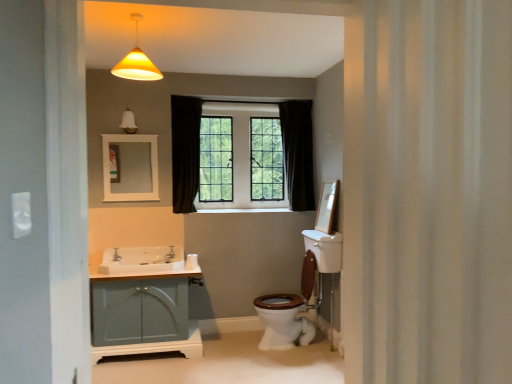
This screenshot has width=512, height=384. What do you see at coordinates (298, 152) in the screenshot?
I see `black glass window at center` at bounding box center [298, 152].

Measure the distance between point (133, 133) and camera.

Point (133, 133) and camera are 12.56 feet apart from each other.

What is the approximate height of matte glass bell at upper center?

It is 11.03 inches.

You are a GUI agent. You are given a task and a screenshot of the screen. Output one action in this format:
    pyautogui.click(x=<x>, y=<y>)
    Task: Click on the white textured shower curtain at right
    This screenshot has height=384, width=512.
    Given the screenshot: What is the action you would take?
    pyautogui.click(x=437, y=191)

This screenshot has width=512, height=384. I want to click on dark fabric curtain at center, the first curtain viewed from the right, so coord(298,152).

Where is `white matte mirror at upper center`? Image resolution: width=512 pixels, height=384 pixels. white matte mirror at upper center is located at coordinates (130, 167).

You are a GUI agent. You are given a task and a screenshot of the screen. Output one action in this format:
    pyautogui.click(x=<x>, y=<y>)
    Task: Click on the black glass window at center
    
    Given the screenshot: What is the action you would take?
    pyautogui.click(x=298, y=152)

From the image's perspective, which is above, dark fabric curtain at center, positioned as the first curtain in left-to-right order, or brushed metal faucet at sink left, which ranks as the 2th faucet in front-to-back order?

dark fabric curtain at center, positioned as the first curtain in left-to-right order, is shown above in the image.

From a real-world perspective, does dark fabric curtain at center, positioned as the first curtain in left-to-right order, stand above brushed metal faucet at sink left, which appears as the first faucet when viewed from the right?

Correct, in the physical world, dark fabric curtain at center, positioned as the first curtain in left-to-right order, is higher than brushed metal faucet at sink left, which appears as the first faucet when viewed from the right.

Consider the image. Which object is more forward, dark fabric curtain at center, positioned as the 2th curtain in right-to-left order, or brushed metal faucet at sink left, arranged as the 1th faucet when viewed from the back?

brushed metal faucet at sink left, arranged as the 1th faucet when viewed from the back, is more forward.

Is dark fabric curtain at center, positioned as the first curtain in left-to-right order, turned away from brushed metal faucet at sink left, arranged as the 1th faucet when viewed from the back?

No, dark fabric curtain at center, positioned as the first curtain in left-to-right order,'s orientation is not away from brushed metal faucet at sink left, arranged as the 1th faucet when viewed from the back.

Is point (199, 155) less distant than point (478, 94)?

No, (199, 155) is behind (478, 94).

Is dark fabric curtain at center, positioned as the first curtain in left-to-right order, touching white textured shower curtain at right?

They are not placed beside each other.

Can you confirm if dark fabric curtain at center, positioned as the 2th curtain in right-to-left order, is bigger than white textured shower curtain at right?

Correct, dark fabric curtain at center, positioned as the 2th curtain in right-to-left order, is larger in size than white textured shower curtain at right.

Can you confirm if dark fabric curtain at center, positioned as the first curtain in left-to-right order, is positioned to the right of white textured shower curtain at right?

No.

Which is in front, point (180, 139) or point (307, 164)?

The point (180, 139) is more forward.

Can you confirm if dark fabric curtain at center, positioned as the 2th curtain in right-to-left order, is thinner than dark fabric curtain at center, which is counted as the 2th curtain, starting from the left?

Correct, the width of dark fabric curtain at center, positioned as the 2th curtain in right-to-left order, is less than that of dark fabric curtain at center, which is counted as the 2th curtain, starting from the left.

Which is in front, dark fabric curtain at center, positioned as the first curtain in left-to-right order, or dark fabric curtain at center, which is counted as the 2th curtain, starting from the left?

Positioned in front is dark fabric curtain at center, positioned as the first curtain in left-to-right order.

Can you tell me how much dark fabric curtain at center, positioned as the first curtain in left-to-right order, and dark fabric curtain at center, which is counted as the 2th curtain, starting from the left, differ in facing direction?

The angular difference between dark fabric curtain at center, positioned as the first curtain in left-to-right order, and dark fabric curtain at center, which is counted as the 2th curtain, starting from the left, is 0.00267 degrees.

What's the angular difference between white matte toilet paper at lower center and dark fabric curtain at center, positioned as the 2th curtain in right-to-left order,'s facing directions?

They differ by 3.28 degrees in their facing directions.

Is white matte toilet paper at lower center oriented towards dark fabric curtain at center, positioned as the first curtain in left-to-right order?

No, white matte toilet paper at lower center is not turned towards dark fabric curtain at center, positioned as the first curtain in left-to-right order.

Looking at this image, which of these two, white matte toilet paper at lower center or dark fabric curtain at center, positioned as the 2th curtain in right-to-left order, is thinner?

Thinner between the two is white matte toilet paper at lower center.

Is white matte toilet paper at lower center surrounding dark fabric curtain at center, positioned as the 2th curtain in right-to-left order?

That's incorrect, dark fabric curtain at center, positioned as the 2th curtain in right-to-left order, is not inside white matte toilet paper at lower center.

How much distance is there between white textured shower curtain at right and brushed metal faucet at sink left, which ranks as the 2th faucet in front-to-back order?

A distance of 3.22 meters exists between white textured shower curtain at right and brushed metal faucet at sink left, which ranks as the 2th faucet in front-to-back order.

From a real-world perspective, does white textured shower curtain at right sit lower than brushed metal faucet at sink left, arranged as the 1th faucet when viewed from the back?

No, from a real-world perspective, white textured shower curtain at right is not below brushed metal faucet at sink left, arranged as the 1th faucet when viewed from the back.

From the picture: Considering the relative positions of white textured shower curtain at right and brushed metal faucet at sink left, arranged as the 1th faucet when viewed from the back, in the image provided, is white textured shower curtain at right to the left of brushed metal faucet at sink left, arranged as the 1th faucet when viewed from the back, from the viewer's perspective?

No.

Is white textured shower curtain at right oriented away from brushed metal faucet at sink left, which ranks as the 2th faucet in front-to-back order?

No, white textured shower curtain at right is not facing away from brushed metal faucet at sink left, which ranks as the 2th faucet in front-to-back order.

Is dark fabric curtain at center, which is counted as the 2th curtain, starting from the left, positioned in front of brushed metal faucet at sink left, arranged as the 1th faucet when viewed from the back?

No, the depth of dark fabric curtain at center, which is counted as the 2th curtain, starting from the left, is greater than that of brushed metal faucet at sink left, arranged as the 1th faucet when viewed from the back.

Is dark fabric curtain at center, which is counted as the 2th curtain, starting from the left, positioned with its back to brushed metal faucet at sink left, which ranks as the 2th faucet in front-to-back order?

No, dark fabric curtain at center, which is counted as the 2th curtain, starting from the left, is not facing the opposite direction of brushed metal faucet at sink left, which ranks as the 2th faucet in front-to-back order.

Does dark fabric curtain at center, which is counted as the 2th curtain, starting from the left, have a lesser height compared to brushed metal faucet at sink left, arranged as the 1th faucet when viewed from the back?

No.

At what (x,y) coordinates should I click in order to perform the action: click on the 1st faucet counting from the left side of the dark fabric curtain at center, which is counted as the 2th curtain, starting from the left. Please return your answer as a coordinate pair (x, y). This screenshot has width=512, height=384. Looking at the image, I should click on (170, 254).

Between dark fabric curtain at center, which is counted as the 2th curtain, starting from the left, and white glossy sink at lower left, which one is positioned behind?

dark fabric curtain at center, which is counted as the 2th curtain, starting from the left, is more distant.

Considering the relative positions of dark fabric curtain at center, the first curtain viewed from the right, and white glossy sink at lower left in the image provided, is dark fabric curtain at center, the first curtain viewed from the right, to the right of white glossy sink at lower left from the viewer's perspective?

Yes, dark fabric curtain at center, the first curtain viewed from the right, is to the right of white glossy sink at lower left.

In terms of width, does dark fabric curtain at center, which is counted as the 2th curtain, starting from the left, look wider or thinner when compared to white glossy sink at lower left?

In the image, dark fabric curtain at center, which is counted as the 2th curtain, starting from the left, appears to be more narrow than white glossy sink at lower left.

This screenshot has height=384, width=512. I want to click on faucet that is the 1st one when counting forward from the dark fabric curtain at center, positioned as the first curtain in left-to-right order, so click(x=170, y=254).

From a real-world perspective, count 2nd curtains upward from the white textured shower curtain at right and point to it. Please provide its 2D coordinates.

[(185, 151)]

Based on their spatial positions, is white glossy sink at lower left or white matte mirror at upper center further from white matte toilet paper at lower center?

Based on the image, white matte mirror at upper center appears to be further to white matte toilet paper at lower center.

From the image, which object appears to be farther from brushed metal faucet at sink left, which appears as the first faucet when viewed from the right, white matte mirror at upper center or matte teal cabinet at lower left?

white matte mirror at upper center is positioned further to the anchor brushed metal faucet at sink left, which appears as the first faucet when viewed from the right.

Considering their positions, is matte teal cabinet at lower left positioned further to white textured shower curtain at right than dark fabric curtain at center, which is counted as the 2th curtain, starting from the left?

The object further to white textured shower curtain at right is dark fabric curtain at center, which is counted as the 2th curtain, starting from the left.

Looking at the image, which one is located closer to white glossy sink at lower left, matte silver faucet at sink left, placed as the second faucet when sorted from back to front, or dark fabric curtain at center, the first curtain viewed from the right?

Among the two, matte silver faucet at sink left, placed as the second faucet when sorted from back to front, is located nearer to white glossy sink at lower left.

When comparing their distances from white matte toilet paper at lower center, does brushed metal faucet at sink left, which ranks as the 2th faucet in front-to-back order, or dark fabric curtain at center, positioned as the first curtain in left-to-right order, seem closer?

brushed metal faucet at sink left, which ranks as the 2th faucet in front-to-back order, lies closer to white matte toilet paper at lower center than the other object.

Based on their spatial positions, is dark fabric curtain at center, the first curtain viewed from the right, or brushed metal faucet at sink left, marked as the second faucet in a left-to-right arrangement, closer to dark fabric curtain at center, positioned as the 2th curtain in right-to-left order?

brushed metal faucet at sink left, marked as the second faucet in a left-to-right arrangement, is positioned closer to the anchor dark fabric curtain at center, positioned as the 2th curtain in right-to-left order.

From the image, which object appears to be farther from black glass window at center, white textured shower curtain at right or white matte toilet paper at lower center?

white textured shower curtain at right is positioned further to the anchor black glass window at center.

Looking at the image, which one is located closer to dark fabric curtain at center, positioned as the 2th curtain in right-to-left order, white glossy sink at lower left or white textured shower curtain at right?

white glossy sink at lower left.

Where is `sink between matte silver faucet at sink left, marked as the first faucet in a left-to-right arrangement, and dark fabric curtain at center, which is counted as the 2th curtain, starting from the left`? sink between matte silver faucet at sink left, marked as the first faucet in a left-to-right arrangement, and dark fabric curtain at center, which is counted as the 2th curtain, starting from the left is located at coordinates (141, 260).

Identify the location of mirror between black glass window at center and matte teal cabinet at lower left in the vertical direction. (130, 167).

In order to click on sink between matte silver faucet at sink left, the 1th faucet in the front-to-back sequence, and matte teal cabinet at lower left from top to bottom in this screenshot , I will do `click(141, 260)`.

At what (x,y) coordinates should I click in order to perform the action: click on light fixture between white textured shower curtain at right and white matte mirror at upper center in the front-back direction. Please return your answer as a coordinate pair (x, y). Image resolution: width=512 pixels, height=384 pixels. Looking at the image, I should click on (128, 122).